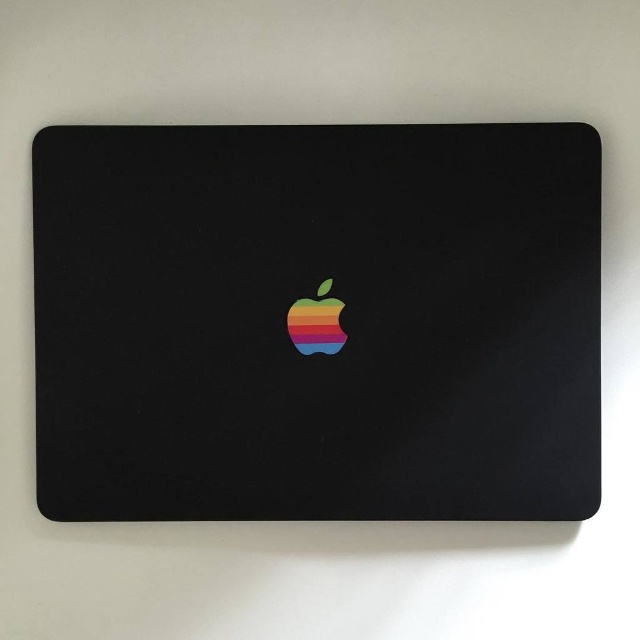
Question: Which point appears farthest from the camera in this image?

Choices:
 (A) (284, 291)
 (B) (298, 337)

Answer: (B)

Question: Which point is farther to the camera?

Choices:
 (A) matte black laptop at center
 (B) rainbow plastic apple at center

Answer: (B)

Question: Which of the following is the closest to the observer?

Choices:
 (A) (337, 337)
 (B) (284, 312)

Answer: (B)

Question: Can you confirm if matte black laptop at center is bigger than rainbow plastic apple at center?

Choices:
 (A) no
 (B) yes

Answer: (B)

Question: Does matte black laptop at center appear on the left side of rainbow plastic apple at center?

Choices:
 (A) no
 (B) yes

Answer: (A)

Question: Can you confirm if matte black laptop at center is positioned to the right of rainbow plastic apple at center?

Choices:
 (A) no
 (B) yes

Answer: (B)